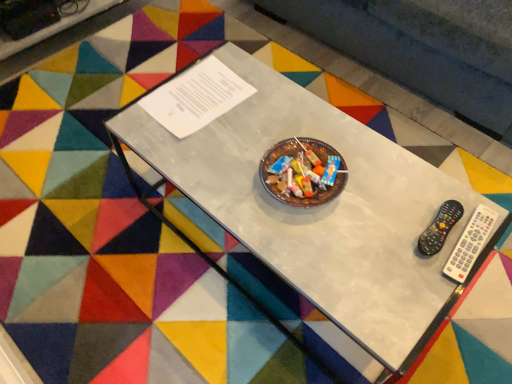
Question: Is point (389, 221) positioned closer to the camera than point (471, 251)?

Choices:
 (A) closer
 (B) farther

Answer: (B)

Question: Is metallic glass table at center to the left or to the right of white plastic remote at right in the image?

Choices:
 (A) right
 (B) left

Answer: (B)

Question: Which object is the farthest from the metallic glass table at center?

Choices:
 (A) white plastic remote at right
 (B) black plastic remote at right

Answer: (A)

Question: Which object is the farthest from the metallic glass table at center?

Choices:
 (A) black plastic remote at right
 (B) white plastic remote at right

Answer: (B)